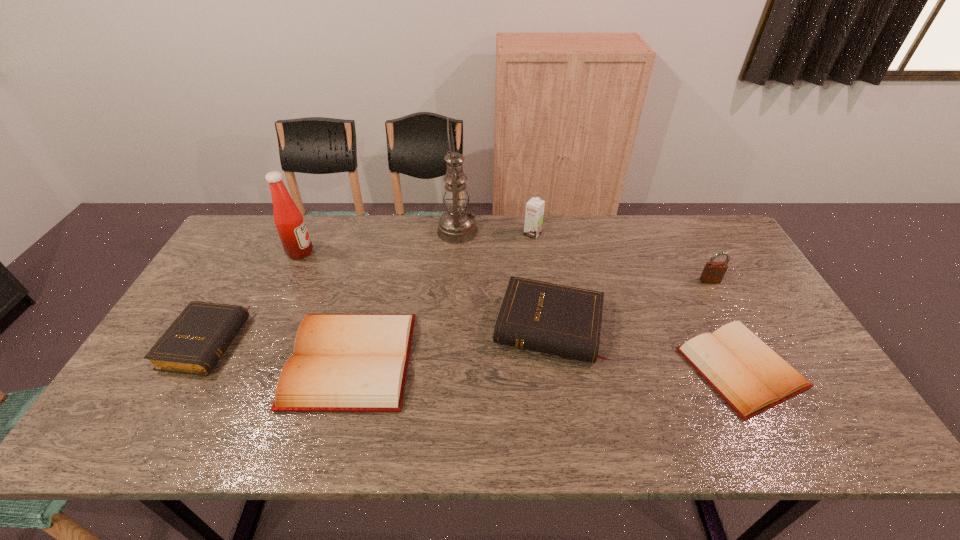
Image resolution: width=960 pixels, height=540 pixels. I want to click on free space located on the front of the bigger gray Bible, so click(x=558, y=396).

Identify the location of free space located 0.320m on the right of the leftmost object. The width and height of the screenshot is (960, 540). (360, 343).

Identify the location of free region located 0.070m on the right of the left red Bible. (437, 360).

You are a GUI agent. You are given a task and a screenshot of the screen. Output one action in this format:
    pyautogui.click(x=<x>, y=<y>)
    Task: Click on the free region located on the left of the shortest Bible
    
    Given the screenshot: What is the action you would take?
    pyautogui.click(x=627, y=368)

At what (x,y) coordinates should I click in order to perform the action: click on oil lamp that is positioned at the far edge. Please return your answer as a coordinate pair (x, y). This screenshot has height=540, width=960. Looking at the image, I should click on (456, 226).

This screenshot has width=960, height=540. What are the coordinates of `condiment at the far edge` in the screenshot? It's located at 291,227.

Identify the location of chocolate milk positioned at the far edge. (534, 213).

Locate an element on the screen. This screenshot has height=540, width=960. object that is at the left edge is located at coordinates coord(194,343).

Identify the location of padlock at the right edge. The height and width of the screenshot is (540, 960). (713, 272).

Image resolution: width=960 pixels, height=540 pixels. Find the location of `Bible that is at the right edge`. Bible that is at the right edge is located at coordinates (751, 377).